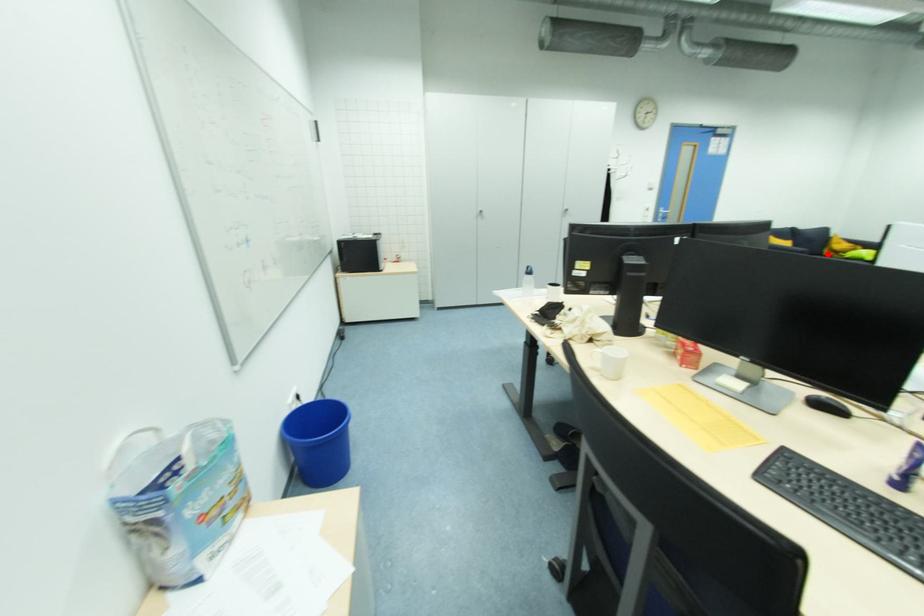
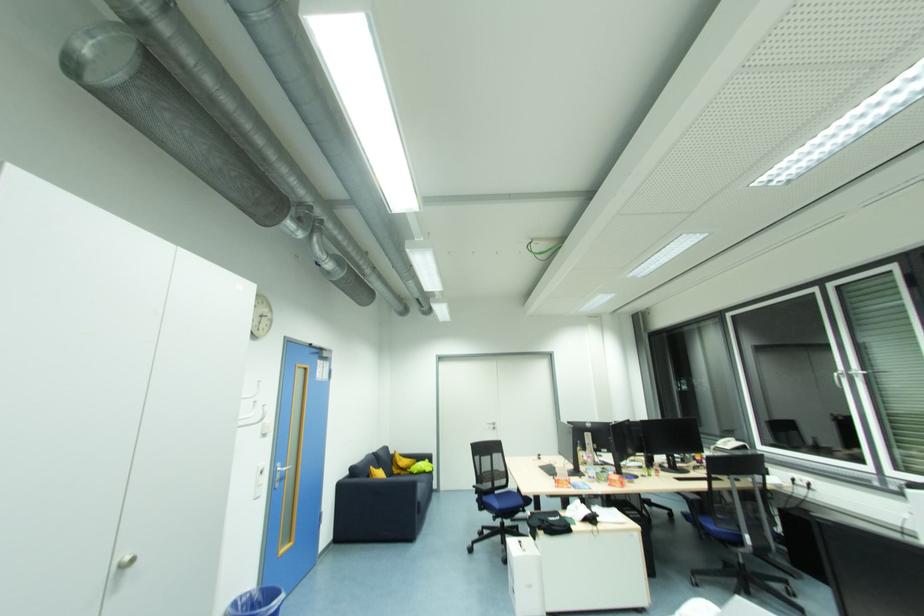
Locate, in the second image, the point that corresponds to the highlighted location in the first image.

(398, 472)